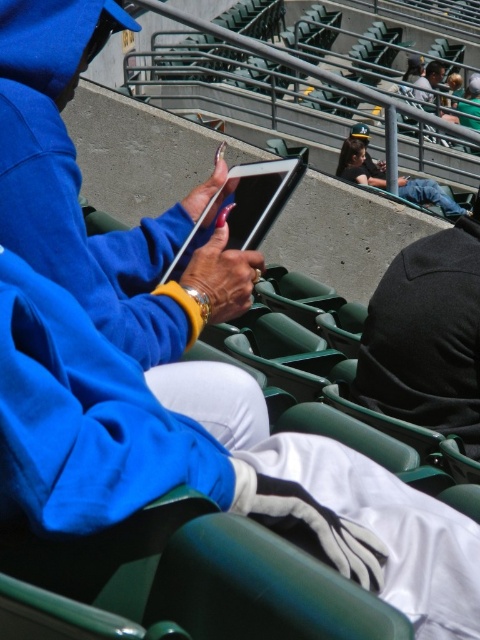
Which of these two, dark gray fabric jacket at center or matte black tablet at center, stands shorter?

Standing shorter between the two is matte black tablet at center.

Consider the image. Can you confirm if dark gray fabric jacket at center is wider than matte black tablet at center?

Yes.

Who is more forward, (371, 360) or (238, 196)?

Point (238, 196) is in front.

At what (x,y) coordinates should I click in order to perform the action: click on dark gray fabric jacket at center. Please return your answer as a coordinate pair (x, y). This screenshot has width=480, height=640. Looking at the image, I should click on (427, 336).